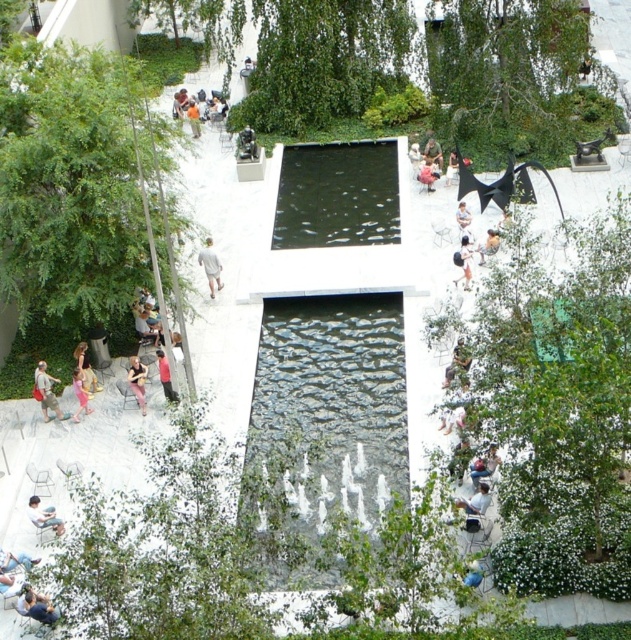
Question: Is white matte person at center-left below pink fabric person at lower left?

Choices:
 (A) yes
 (B) no

Answer: (B)

Question: Is light brown wooden chair at upper center to the left of blue denim shirt at lower left from the viewer's perspective?

Choices:
 (A) yes
 (B) no

Answer: (A)

Question: Estimate the real-world distances between objects in this image. Which object is closer to the light blue jeans at lower left?

Choices:
 (A) light brown leather jacket at upper center
 (B) blue denim shirt at lower left
 (C) green concrete pond at center

Answer: (B)

Question: Which object is positioned farthest from the pink fabric person at lower left?

Choices:
 (A) light blue jeans at lower left
 (B) black reflective water at center
 (C) matte black sculpture at center

Answer: (C)

Question: Is green leafy tree at left thinner than matte black sculpture at center?

Choices:
 (A) no
 (B) yes

Answer: (A)

Question: Which point appears closest to the camera in this image?

Choices:
 (A) 213,285
 (B) 52,406

Answer: (B)